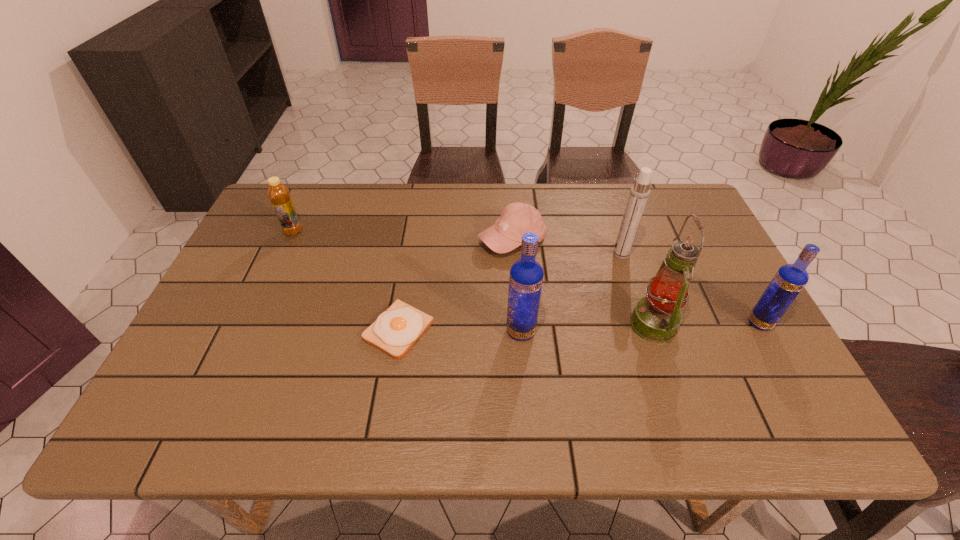
You are a GUI agent. You are given a task and a screenshot of the screen. Output one action in this format:
    pyautogui.click(x=<x>, y=<y>)
    Task: Click on the left vodka
    Image resolution: width=960 pixels, height=540 pixels.
    Given the screenshot: What is the action you would take?
    pyautogui.click(x=526, y=275)

Where is `the right vodka`? This screenshot has height=540, width=960. the right vodka is located at coordinates (790, 279).

You are a GUI agent. You are given a task and a screenshot of the screen. Output one action in this format:
    pyautogui.click(x=<x>, y=<y>)
    Task: Click on the shorter vodka
    The width and height of the screenshot is (960, 540).
    Given the screenshot: What is the action you would take?
    790,279

Image resolution: width=960 pixels, height=540 pixels. What are the coordinates of `baseball cap` in the screenshot? It's located at (516, 219).

Where is `the fifth tallest object`? Image resolution: width=960 pixels, height=540 pixels. the fifth tallest object is located at coordinates (279, 195).

The image size is (960, 540). In order to click on bottle in this screenshot , I will do `click(279, 195)`.

Find the location of `aerosol can`. aerosol can is located at coordinates [x=639, y=193].

This screenshot has width=960, height=540. Find the location of `oil lamp`. oil lamp is located at coordinates (656, 318).

At what (x,y) coordinates should I click in order to perform the action: click on the shortest object. Please return your answer as a coordinate pair (x, y). The image size is (960, 540). Looking at the image, I should click on (396, 330).

This screenshot has height=540, width=960. Find the location of `the second object from left to right`. the second object from left to right is located at coordinates (396, 330).